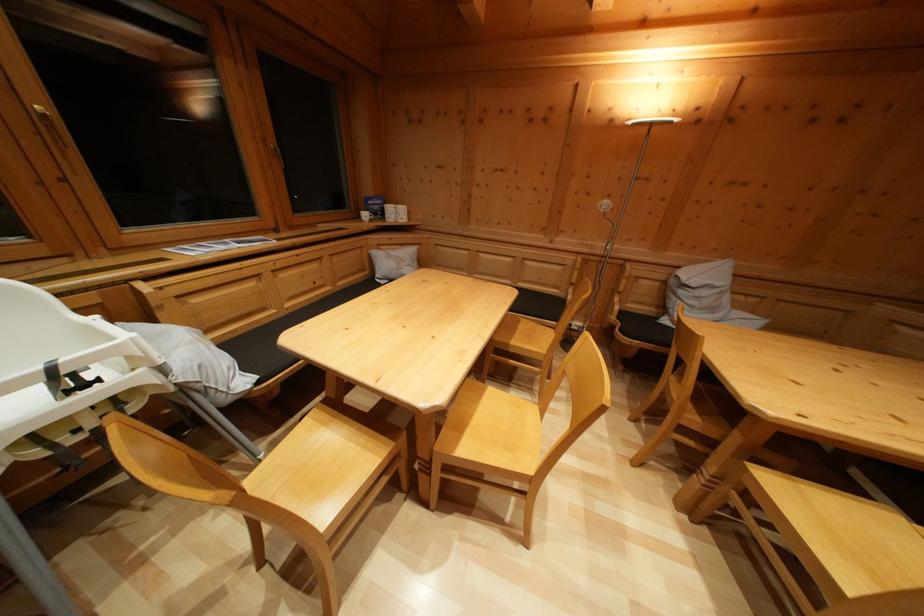
At what (x,y) coordinates should I click in order to perform the action: click on lamp switch. Please return your answer as a coordinate pair (x, y). The width and height of the screenshot is (924, 616). Looking at the image, I should click on (604, 207).